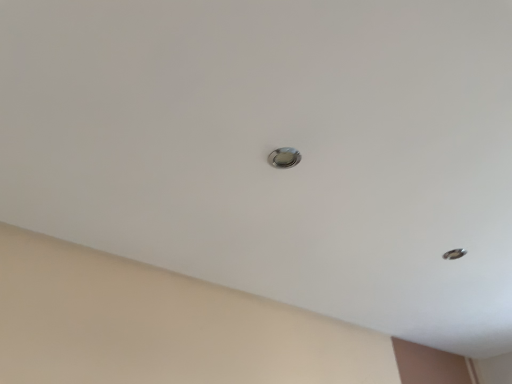
Question: Is metallic hole at upper right oriented away from satin silver door handle at center?

Choices:
 (A) no
 (B) yes

Answer: (A)

Question: Is metallic hole at upper right outside satin silver door handle at center?

Choices:
 (A) no
 (B) yes

Answer: (B)

Question: Considering the relative positions of metallic hole at upper right and satin silver door handle at center in the image provided, is metallic hole at upper right behind satin silver door handle at center?

Choices:
 (A) yes
 (B) no

Answer: (A)

Question: Is metallic hole at upper right at the left side of satin silver door handle at center?

Choices:
 (A) no
 (B) yes

Answer: (A)

Question: Can you confirm if metallic hole at upper right is shorter than satin silver door handle at center?

Choices:
 (A) yes
 (B) no

Answer: (B)

Question: From the image's perspective, is metallic hole at upper right beneath satin silver door handle at center?

Choices:
 (A) no
 (B) yes

Answer: (B)

Question: From the image's perspective, is satin silver door handle at center located beneath metallic hole at upper right?

Choices:
 (A) yes
 (B) no

Answer: (B)

Question: From a real-world perspective, is satin silver door handle at center under metallic hole at upper right?

Choices:
 (A) yes
 (B) no

Answer: (A)

Question: From a real-world perspective, is satin silver door handle at center on metallic hole at upper right?

Choices:
 (A) yes
 (B) no

Answer: (B)

Question: Is satin silver door handle at center beside metallic hole at upper right?

Choices:
 (A) no
 (B) yes

Answer: (A)

Question: Is satin silver door handle at center facing away from metallic hole at upper right?

Choices:
 (A) yes
 (B) no

Answer: (B)

Question: Can we say satin silver door handle at center lies outside metallic hole at upper right?

Choices:
 (A) no
 (B) yes

Answer: (B)

Question: From their relative heights in the image, would you say satin silver door handle at center is taller or shorter than metallic hole at upper right?

Choices:
 (A) short
 (B) tall

Answer: (A)